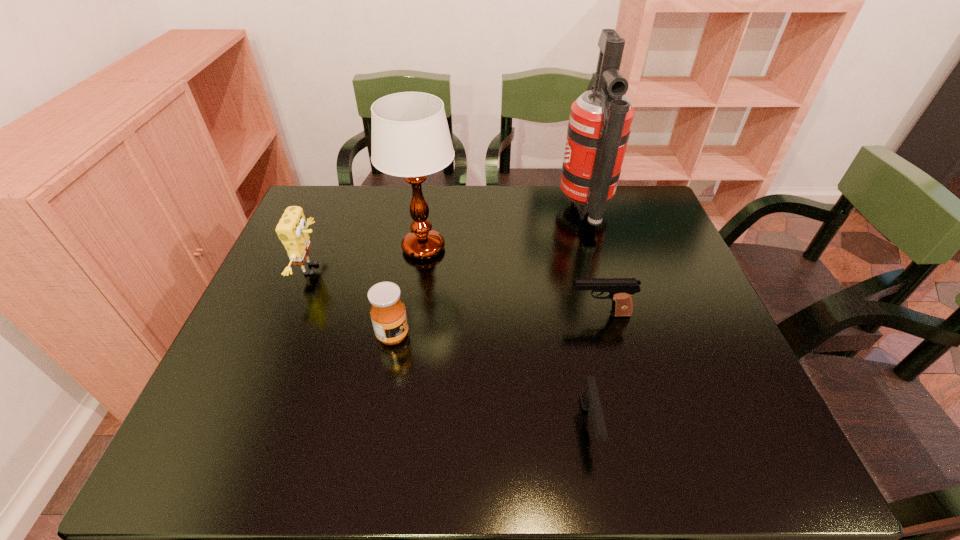
The image size is (960, 540). I want to click on table lamp located at the far edge, so click(x=410, y=138).

What are the coordinates of `object at the near edge` in the screenshot? It's located at (590, 400).

Where is `object that is at the left edge`? Image resolution: width=960 pixels, height=540 pixels. object that is at the left edge is located at coordinates (292, 231).

This screenshot has height=540, width=960. I want to click on object that is at the right edge, so click(600, 121).

Identify the location of object located at the far right corner. The image size is (960, 540). click(x=600, y=121).

This screenshot has width=960, height=540. I want to click on vacant position at the far edge of the desktop, so click(610, 221).

At what (x,y) coordinates should I click in order to perform the action: click on free region at the left edge of the desktop. Please return your answer as a coordinate pair (x, y). Looking at the image, I should click on (246, 335).

In the image, there is a desktop. Where is `vacant space at the right edge`? This screenshot has width=960, height=540. vacant space at the right edge is located at coordinates (666, 245).

Find the location of a particular element. This screenshot has width=960, height=540. blank space at the near left corner is located at coordinates (235, 459).

This screenshot has height=540, width=960. Find the location of `free space between the fourth farthest object and the second tallest object`. free space between the fourth farthest object and the second tallest object is located at coordinates (512, 281).